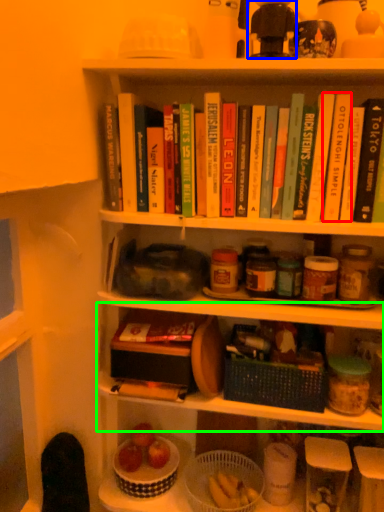
Question: Considering the real-world distances, which object is farthest from paperback book (highlighted by a red box)? toy (highlighted by a blue box) or shelf (highlighted by a green box)?

Choices:
 (A) toy
 (B) shelf

Answer: (B)